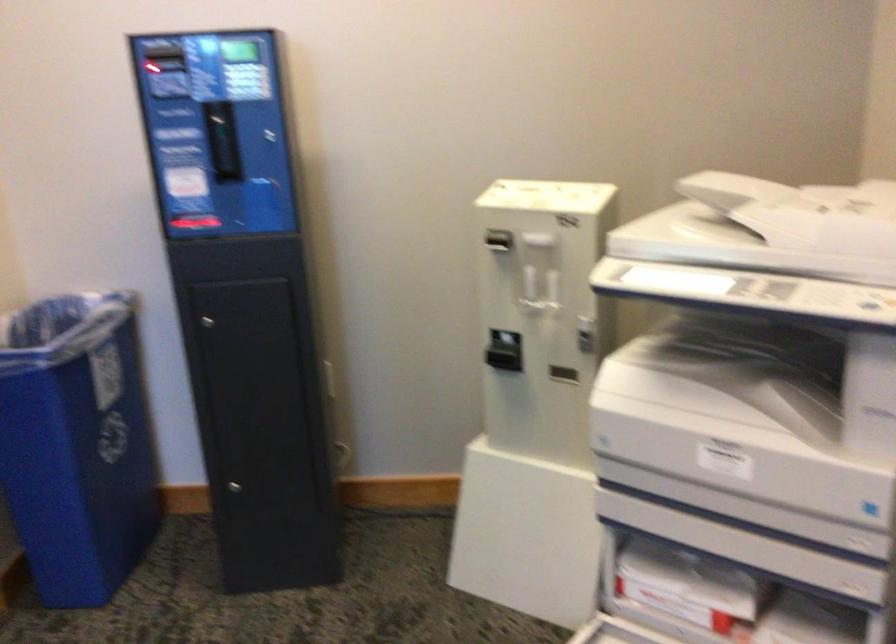
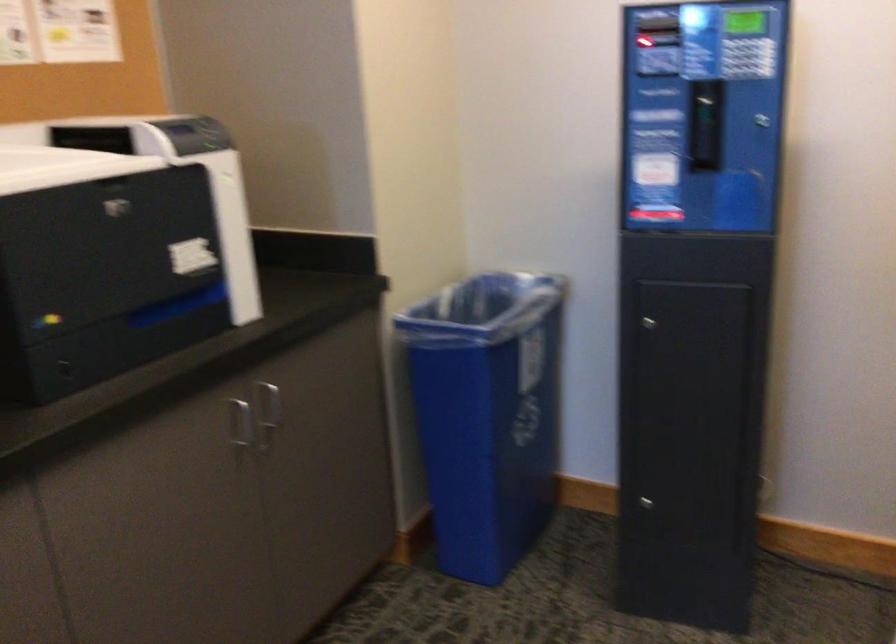
Question: Based on the continuous images, in which direction is the camera rotating? Reply with the corresponding letter.

Choices:
 (A) Left
 (B) Right
 (C) Up
 (D) Down

Answer: (A)